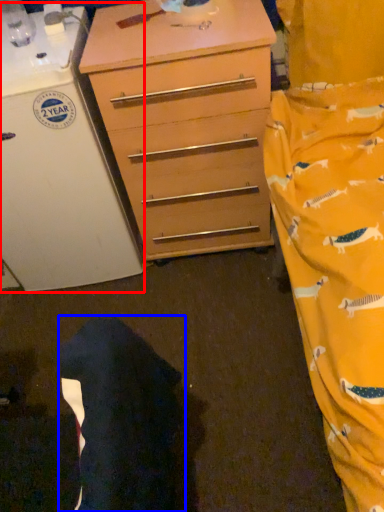
Question: Among these objects, which one is nearest to the camera, appliance (highlighted by a red box) or robe (highlighted by a blue box)?

Choices:
 (A) appliance
 (B) robe

Answer: (B)